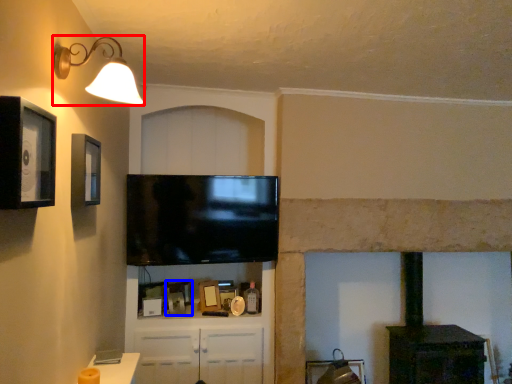
Question: Which point is closer to the camera, light fixture (highlighted by a red box) or picture frame (highlighted by a blue box)?

Choices:
 (A) light fixture
 (B) picture frame

Answer: (A)